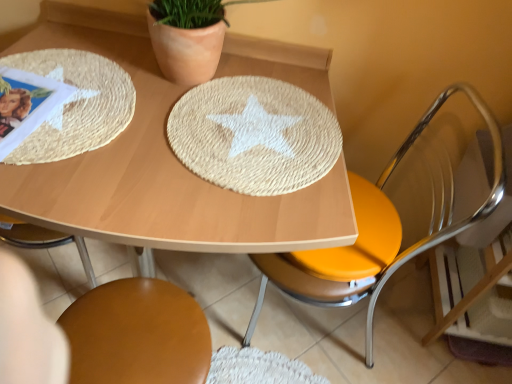
The image size is (512, 384). Identify the location of free location to the right of raffia textured placemat at upper left. (210, 139).